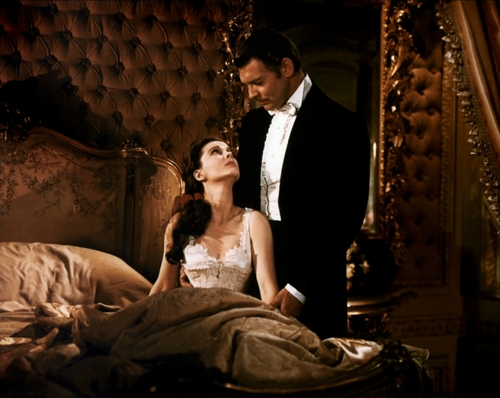
The width and height of the screenshot is (500, 398). I want to click on bed head, so click(50, 147).